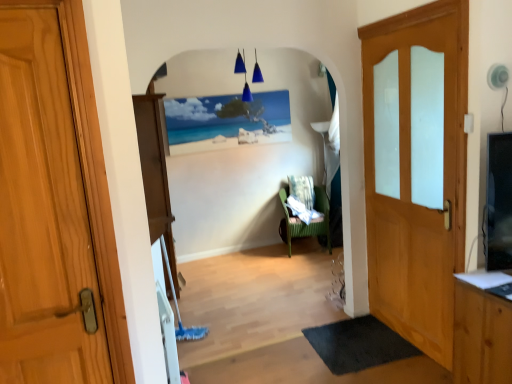
In order to click on vacant space in front of green wicker chair at center in this screenshot , I will do `click(305, 263)`.